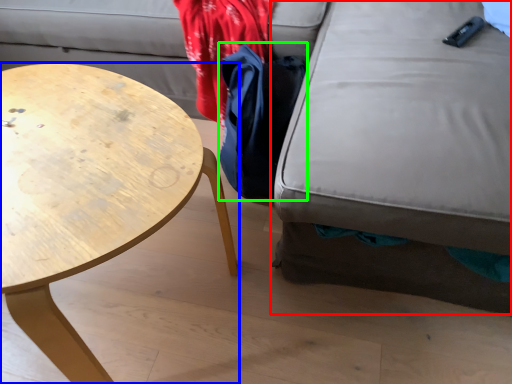
Question: Estimate the real-world distances between objects in this image. Which object is farther from swivel chair (highlighted by a red box), coffee table (highlighted by a blue box) or cloak (highlighted by a green box)?

Choices:
 (A) coffee table
 (B) cloak

Answer: (A)